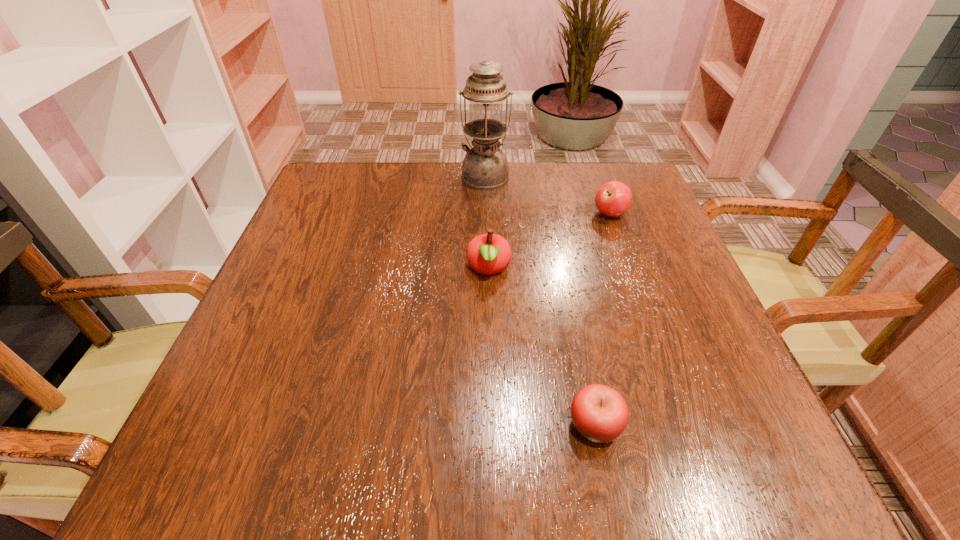
Image resolution: width=960 pixels, height=540 pixels. What are the coordinates of `free space located 0.080m on the front of the second farthest apple` in the screenshot? It's located at (490, 321).

Locate an element on the screen. The width and height of the screenshot is (960, 540). free space located 0.400m on the left of the nearest object is located at coordinates (299, 425).

Locate an element on the screen. This screenshot has height=540, width=960. oil lamp situated at the far edge is located at coordinates (485, 166).

This screenshot has height=540, width=960. I want to click on apple located in the far edge section of the desktop, so click(614, 198).

This screenshot has width=960, height=540. Identify the location of object located at the near edge. pyautogui.click(x=600, y=413).

You are a GUI agent. You are given a task and a screenshot of the screen. Output one action in this format:
    pyautogui.click(x=<x>, y=<y>)
    Task: Click on the object positioned at the right edge
    The image size is (960, 540).
    Given the screenshot: What is the action you would take?
    pyautogui.click(x=614, y=198)

The image size is (960, 540). Identify the location of object that is at the far right corner. tap(614, 198).

The image size is (960, 540). What are the coordinates of `vacant space at the far edge of the desktop` in the screenshot? It's located at (471, 191).

Where is `vacant space at the near edge of the desktop`? vacant space at the near edge of the desktop is located at coordinates (537, 483).

At what (x,y) coordinates should I click in order to perform the action: click on free region at the left edge. Please return your answer as a coordinate pair (x, y). The height and width of the screenshot is (540, 960). Looking at the image, I should click on click(x=337, y=301).